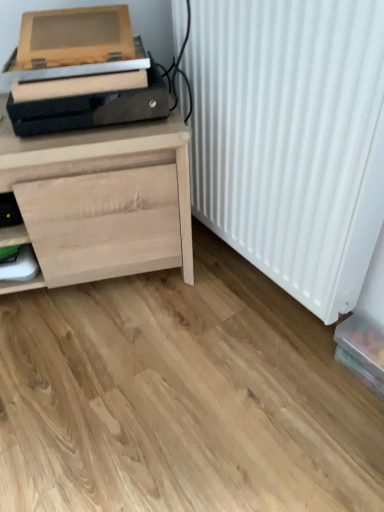
Identify the location of empty space that is ontop of wooden printer at upper left (from a real-world perspective). This screenshot has width=384, height=512. (77, 10).